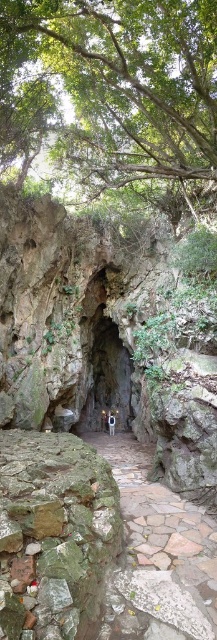
This screenshot has width=217, height=640. I want to click on green leafy tree at upper center, so [126, 83].

Image resolution: width=217 pixels, height=640 pixels. I want to click on green leafy tree at upper center, so 126,83.

Which is more to the right, green leafy tree at upper center or rough stone cave at center?

Positioned to the right is rough stone cave at center.

Where is `green leafy tree at upper center`? The height and width of the screenshot is (640, 217). green leafy tree at upper center is located at coordinates (126, 83).

I want to click on rough stone cave at center, so click(x=103, y=358).

Describe the element at coordinates (103, 358) in the screenshot. The width and height of the screenshot is (217, 640). I see `rough stone cave at center` at that location.

Image resolution: width=217 pixels, height=640 pixels. Find the location of `rough stone cave at center`. rough stone cave at center is located at coordinates click(103, 358).